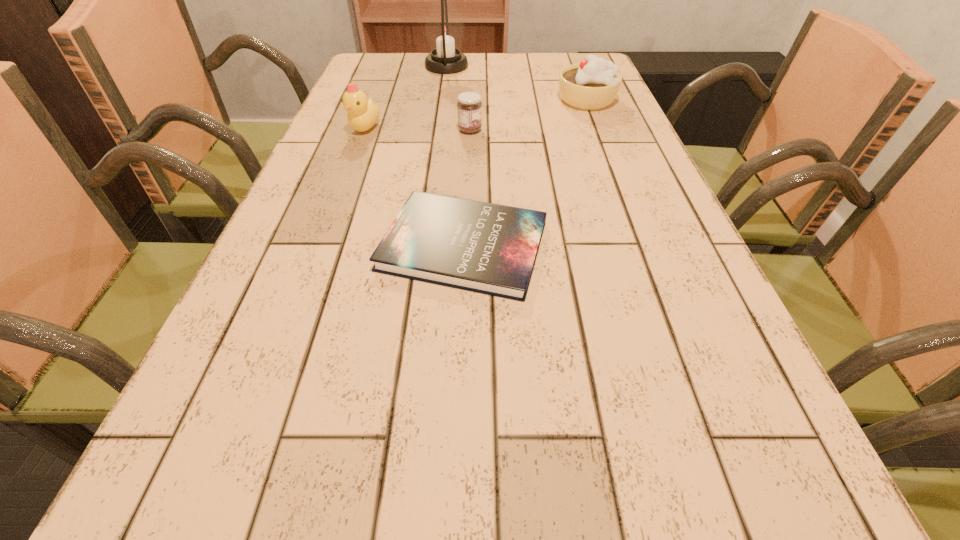
In order to click on free point between the whipped cream and the farthest object in this screenshot , I will do `click(516, 83)`.

Where is `empty space between the rightmost object and the farthest object`? This screenshot has width=960, height=540. empty space between the rightmost object and the farthest object is located at coordinates (516, 83).

This screenshot has width=960, height=540. Find the location of `free space that is in between the oil lamp and the duckling`. free space that is in between the oil lamp and the duckling is located at coordinates (406, 97).

I want to click on free space between the duckling and the jam, so click(x=418, y=129).

Locate an element on the screen. This screenshot has height=540, width=960. free spot between the shortest object and the fourth nearest object is located at coordinates (525, 173).

The height and width of the screenshot is (540, 960). Find the location of `free point between the jam and the fourth nearest object`. free point between the jam and the fourth nearest object is located at coordinates (528, 115).

You are a GUI agent. You are given a task and a screenshot of the screen. Output one action in this format:
    pyautogui.click(x=<x>, y=<y>)
    Task: Click on the free spot between the leftmost object and the shortest object
    
    Given the screenshot: What is the action you would take?
    pyautogui.click(x=414, y=187)

Find the location of a particular element. This screenshot has width=960, height=540. free space between the fourth tallest object and the shortest object is located at coordinates (467, 188).

This screenshot has height=540, width=960. In order to click on object identified as the third closest to the rightmost object in this screenshot , I will do pos(488,248).

This screenshot has height=540, width=960. I want to click on object that is the second closest to the jam, so click(x=593, y=84).